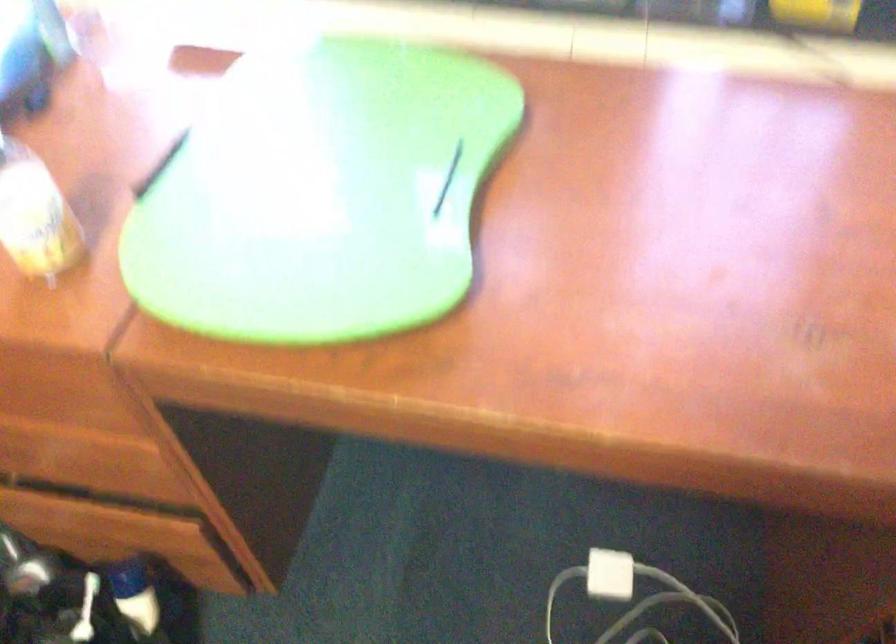
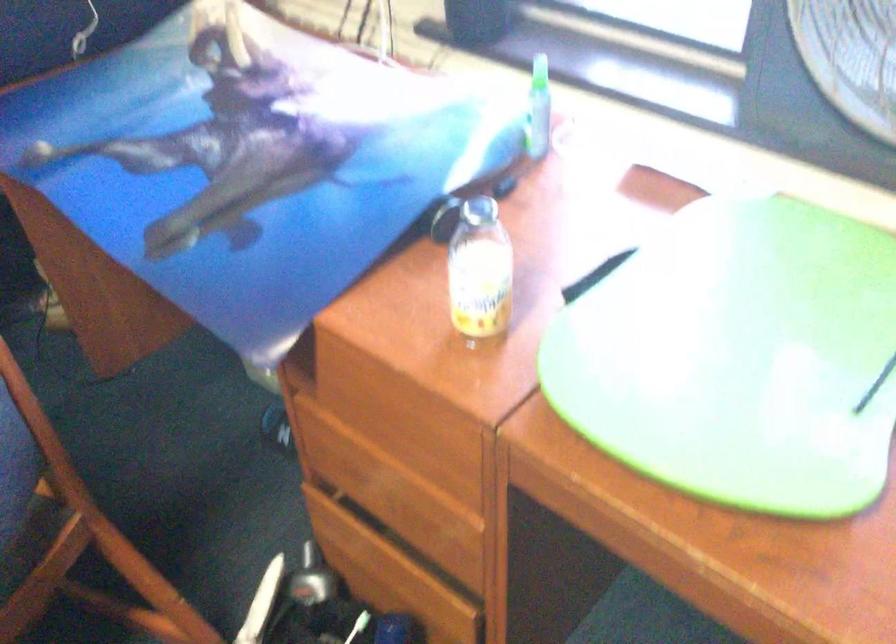
Question: Based on the continuous images, in which direction is the camera rotating? Reply with the corresponding letter.

Choices:
 (A) Left
 (B) Right
 (C) Up
 (D) Down

Answer: (A)